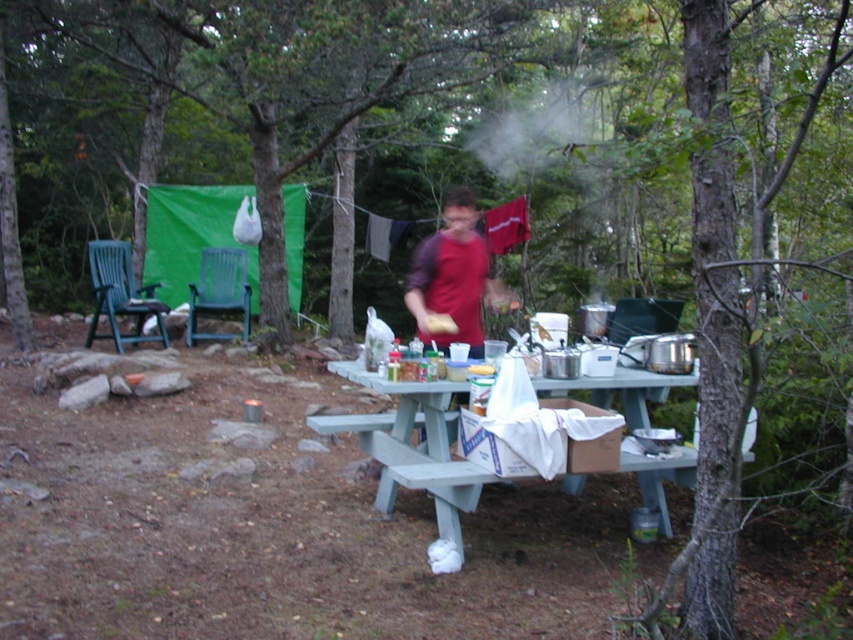
You are a camper who wants to place a small backpack between the green painted wood picnic table at center and the matte red shirt at center. Based on their positions, which object should the backpack be closer to?

The green painted wood picnic table at center is to the left of the matte red shirt at center, so the backpack should be placed closer to the matte red shirt at center to be between them.